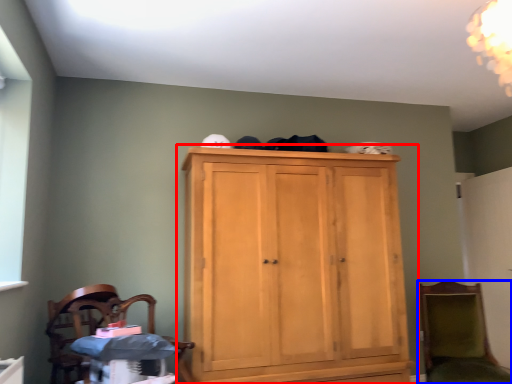
Question: Among these objects, which one is nearest to the camera, cupboard (highlighted by a red box) or chair (highlighted by a blue box)?

Choices:
 (A) cupboard
 (B) chair

Answer: (A)